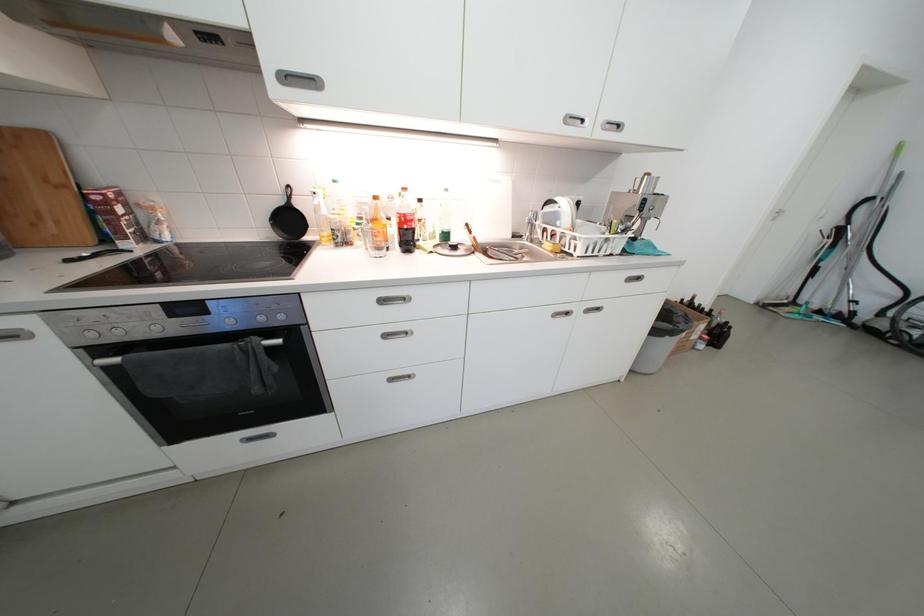
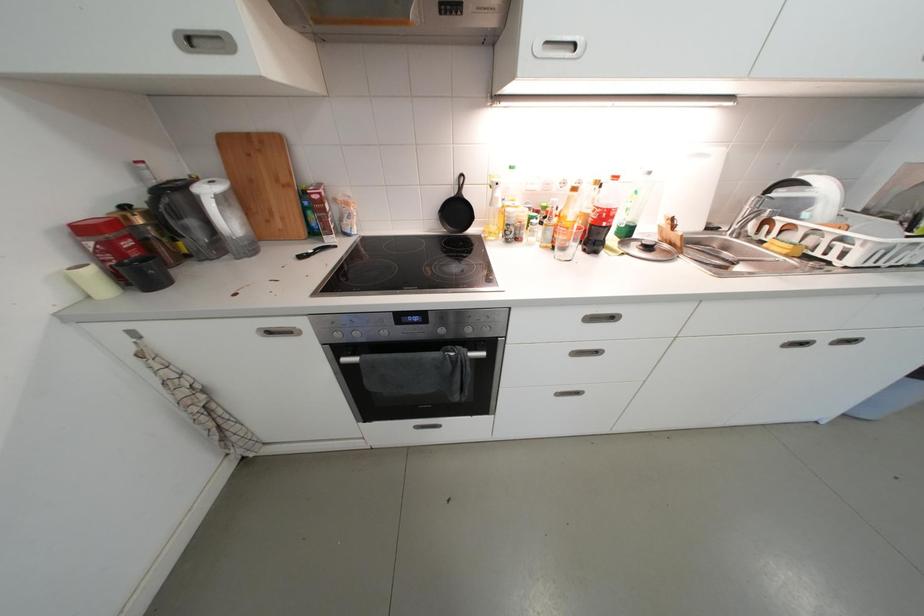
Question: What movement of the cameraman would produce the second image?

Choices:
 (A) Left
 (B) Right
 (C) Forward
 (D) Backward

Answer: (A)